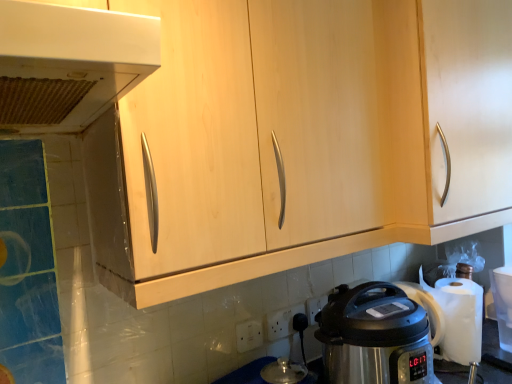
Question: Which direction should I rotate to face white plastic electric outlet at lower center, positioned as the 1th electric outlet in right-to-left order, — up or down?

Choices:
 (A) down
 (B) up

Answer: (A)

Question: Considering the relative sizes of light wood cabinet at center and stainless steel pressure cooker at lower right in the image provided, is light wood cabinet at center bigger than stainless steel pressure cooker at lower right?

Choices:
 (A) yes
 (B) no

Answer: (A)

Question: Is the surface of light wood cabinet at center in direct contact with stainless steel pressure cooker at lower right?

Choices:
 (A) yes
 (B) no

Answer: (B)

Question: Does light wood cabinet at center come in front of stainless steel pressure cooker at lower right?

Choices:
 (A) yes
 (B) no

Answer: (A)

Question: Does light wood cabinet at center appear on the left side of stainless steel pressure cooker at lower right?

Choices:
 (A) yes
 (B) no

Answer: (A)

Question: From the image's perspective, does light wood cabinet at center appear lower than stainless steel pressure cooker at lower right?

Choices:
 (A) yes
 (B) no

Answer: (B)

Question: Is light wood cabinet at center wider than stainless steel pressure cooker at lower right?

Choices:
 (A) yes
 (B) no

Answer: (B)

Question: Would you say light wood cabinet at center is part of white plastic electric outlet at lower center, which is the second electric outlet in back-to-front order,'s contents?

Choices:
 (A) yes
 (B) no

Answer: (B)

Question: Is white plastic electric outlet at lower center, which ranks as the second electric outlet in left-to-right order, positioned far away from light wood cabinet at center?

Choices:
 (A) yes
 (B) no

Answer: (B)

Question: From a real-world perspective, is white plastic electric outlet at lower center, which is the second electric outlet in back-to-front order, on top of light wood cabinet at center?

Choices:
 (A) no
 (B) yes

Answer: (A)

Question: Is white plastic electric outlet at lower center, which ranks as the second electric outlet in left-to-right order, touching light wood cabinet at center?

Choices:
 (A) yes
 (B) no

Answer: (B)

Question: From the image's perspective, is white plastic electric outlet at lower center, which is the second electric outlet in back-to-front order, below light wood cabinet at center?

Choices:
 (A) no
 (B) yes

Answer: (B)

Question: Is white plastic electric outlet at lower center, which ranks as the second electric outlet in left-to-right order, looking in the opposite direction of light wood cabinet at center?

Choices:
 (A) no
 (B) yes

Answer: (A)

Question: Is white plastic electric outlet at lower center, positioned as the 1th electric outlet in right-to-left order, outside of white plastic range hood at upper left?

Choices:
 (A) yes
 (B) no

Answer: (A)